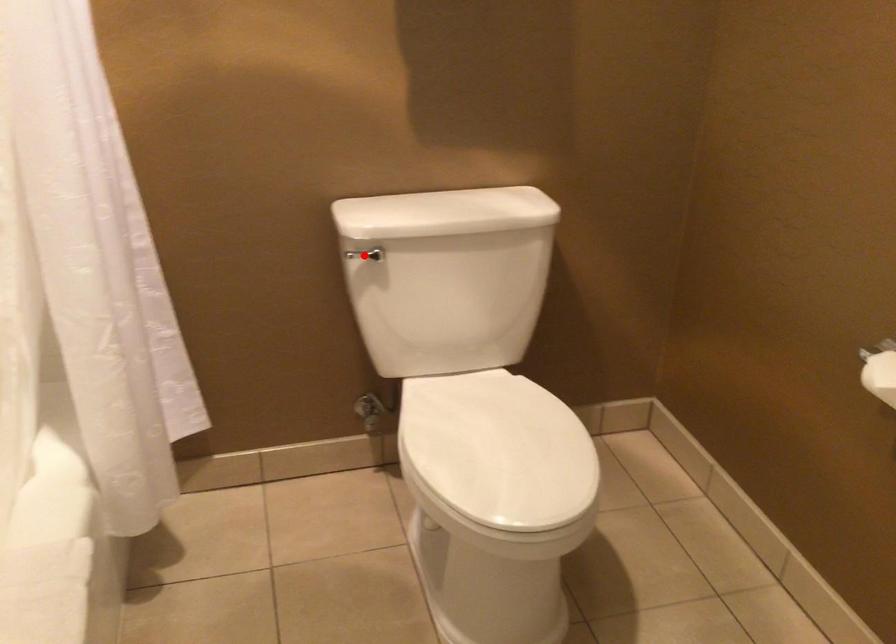
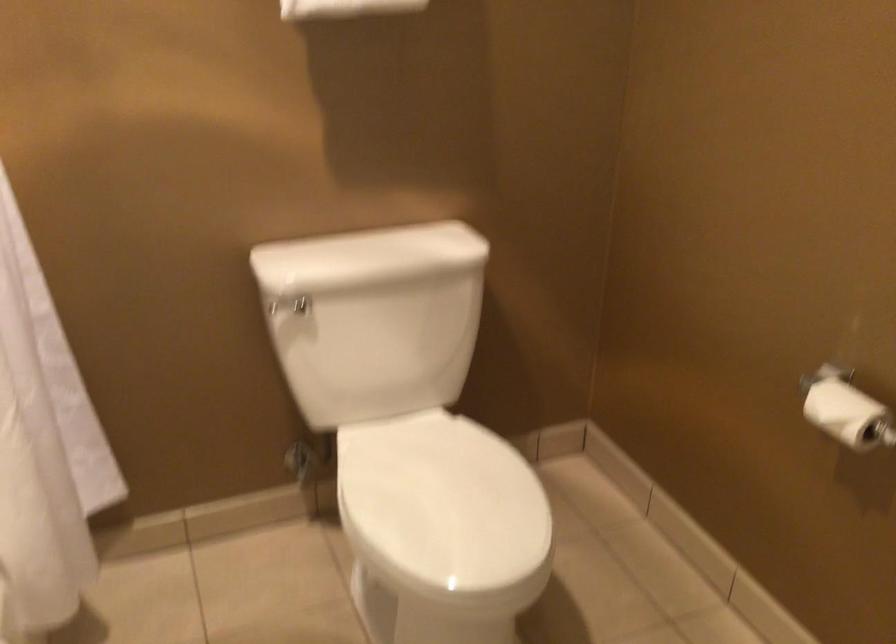
The point at the highlighted location is marked in the first image. Where is the corresponding point in the second image?

(289, 307)